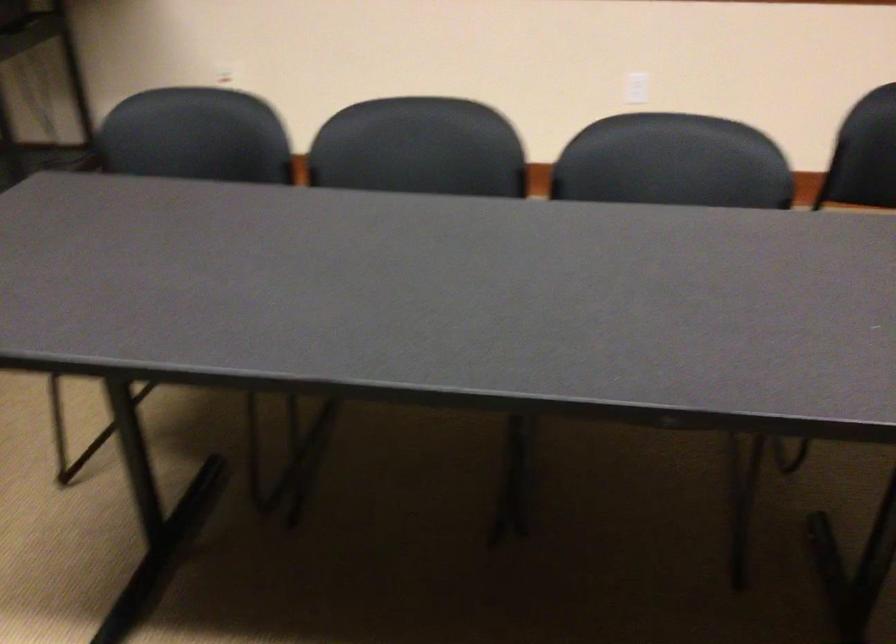
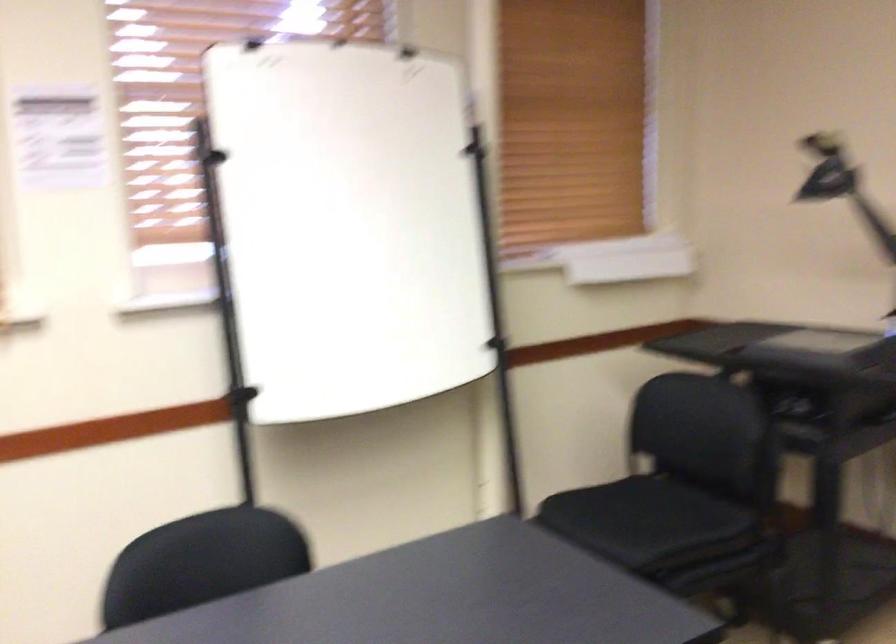
Question: The camera is either moving clockwise (left) or counter-clockwise (right) around the object. The first image is from the beginning of the video and the second image is from the end. Is the camera moving left or right when shooting the video?

Choices:
 (A) Left
 (B) Right

Answer: (B)